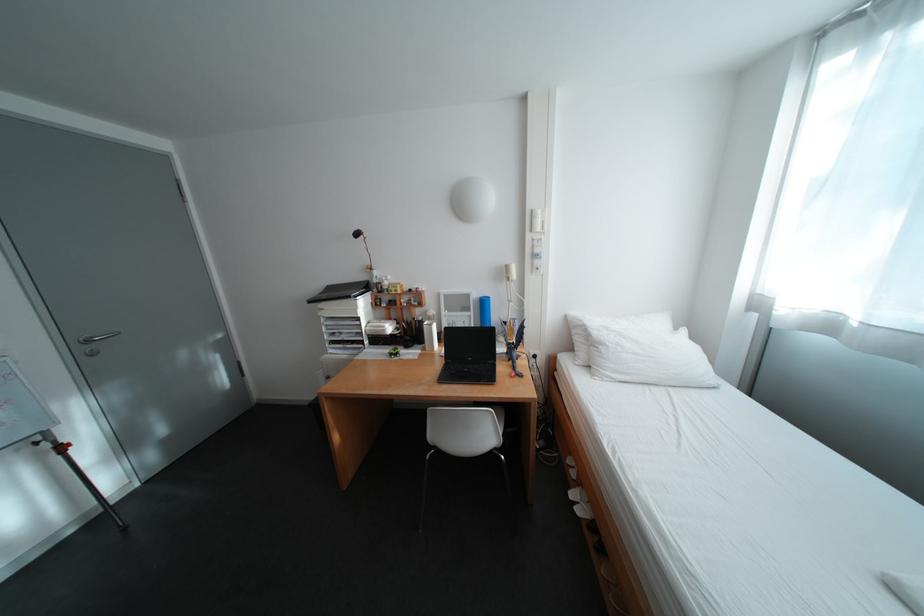
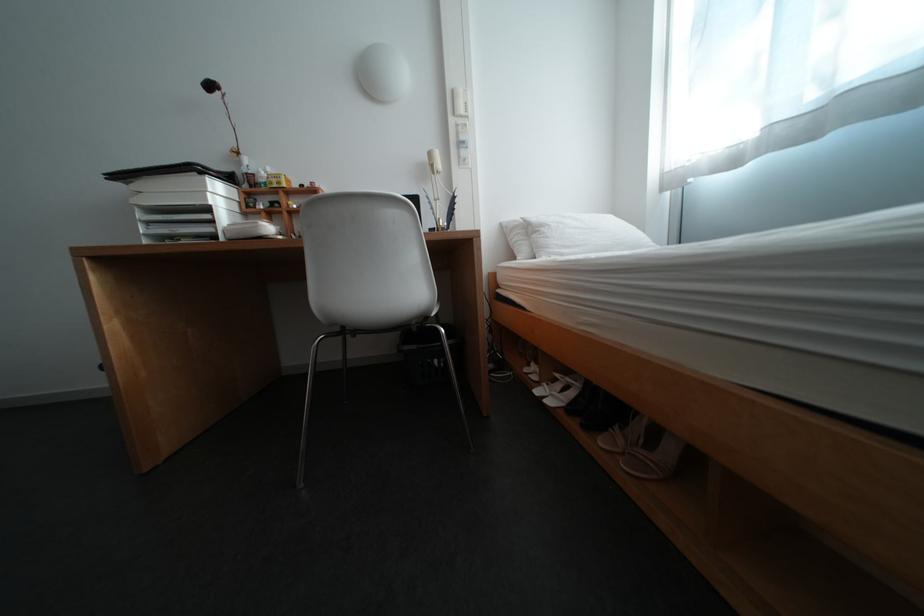
Question: I am providing you with two images of the same scene from different viewpoints. Which of the following objects are not visible in image2?

Choices:
 (A) wall switch panel
 (B) white paper tray
 (C) black mesh trashcan
 (D) none of these

Answer: (D)